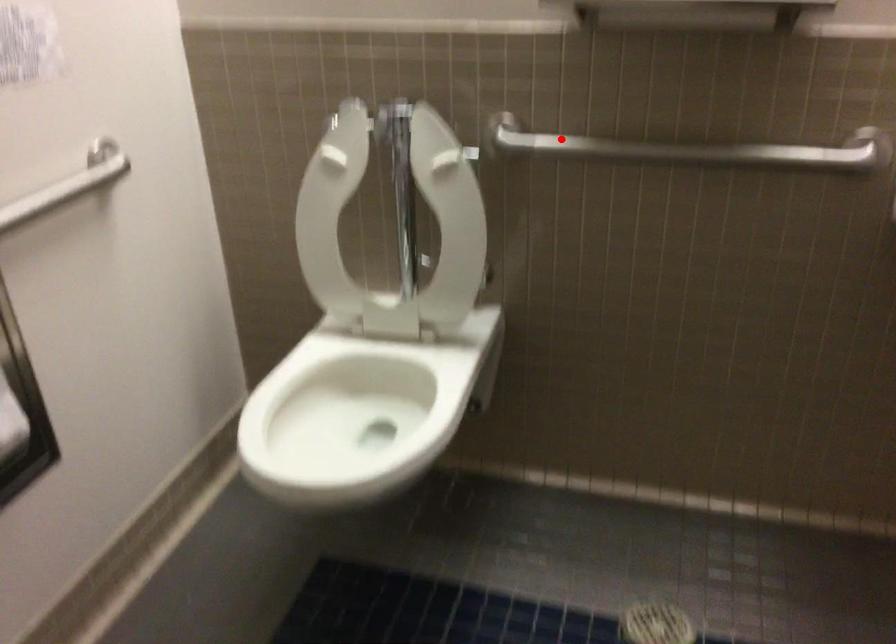
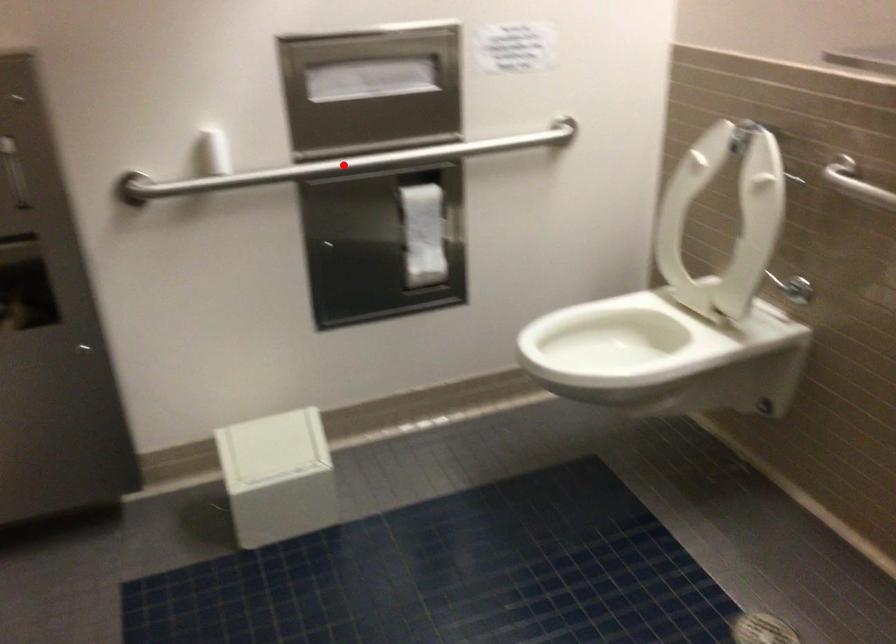
I am providing you with two images of the same scene from different viewpoints. A red point is marked on the first image and another point is marked on the second image. Is the marked point in image1 the same physical position as the marked point in image2?

No